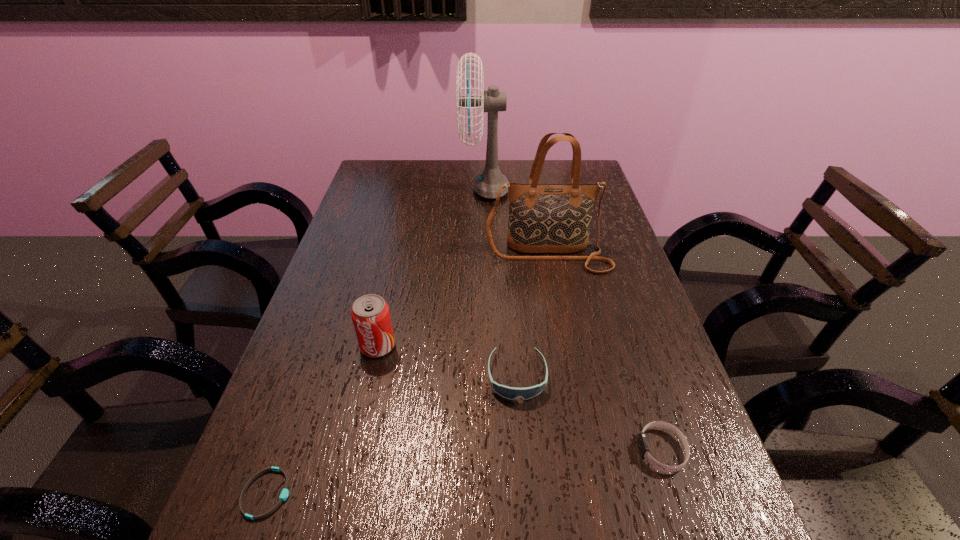
This screenshot has height=540, width=960. I want to click on object that can be found as the second closest to the goggles, so click(x=370, y=314).

The height and width of the screenshot is (540, 960). In order to click on object identified as the second closest to the right wristband in this screenshot , I will do `click(548, 218)`.

In order to click on free space that satisfies the following two spatial constraints: 1. on the front-facing side of the third shortest object; 2. on the buckle of the leftmost object in this screenshot , I will do `click(526, 494)`.

Identify the location of vacant space that satisfies the following two spatial constraints: 1. on the front-facing side of the second farthest object; 2. on the buckle of the left wristband. (592, 494).

Locate an element on the screen. vacant space that satisfies the following two spatial constraints: 1. on the front-facing side of the second farthest object; 2. on the buckle of the shortest object is located at coordinates (592, 494).